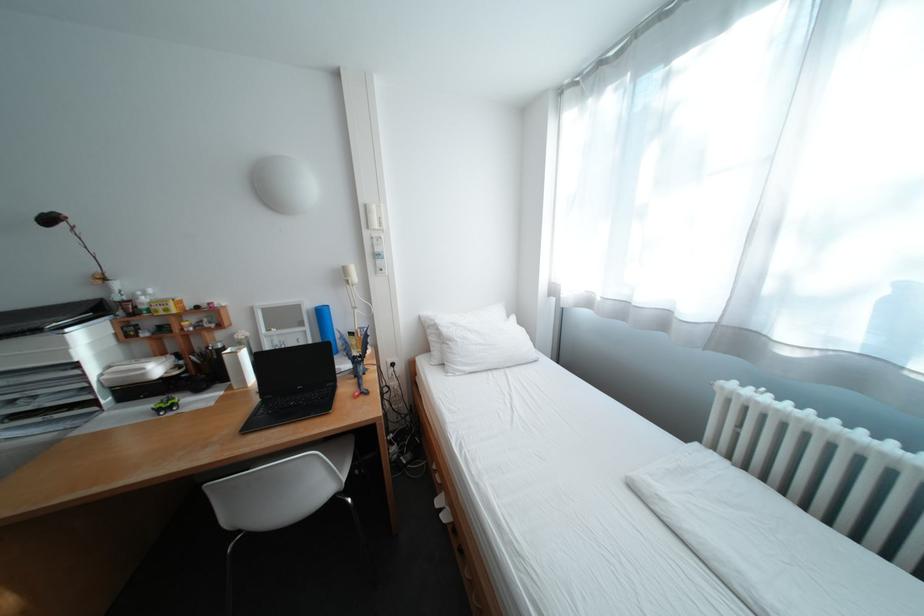
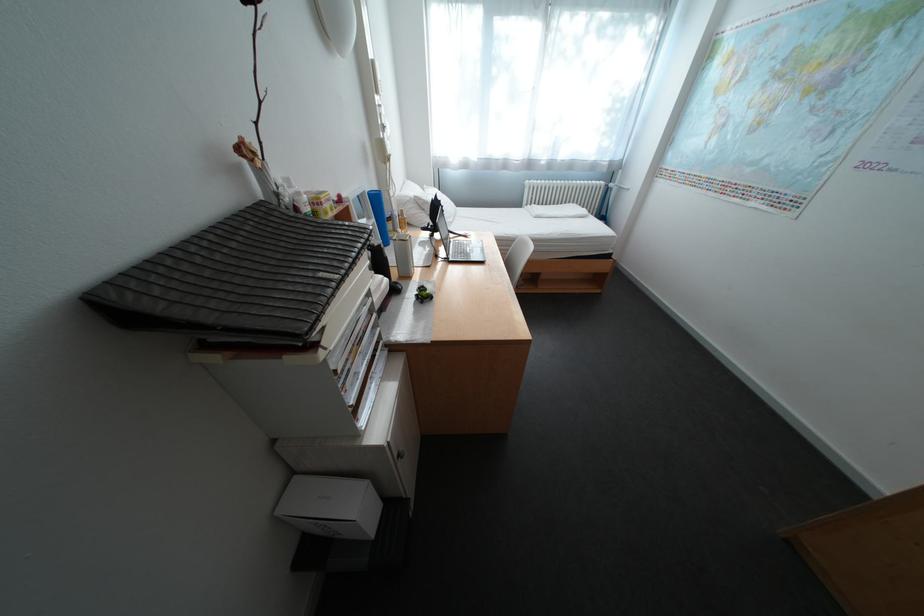
In the second image, find the point that corresponds to (x=444, y=323) in the first image.

(420, 200)